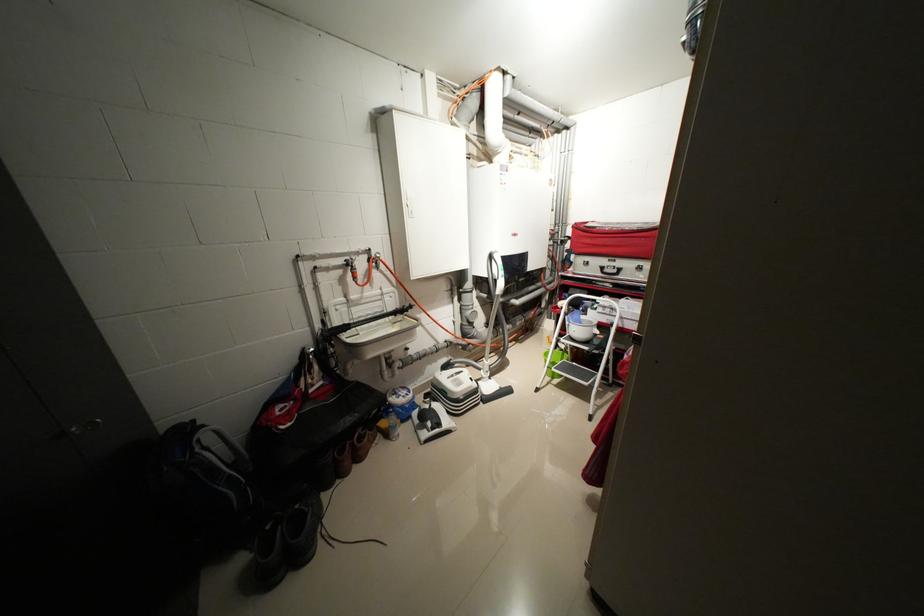
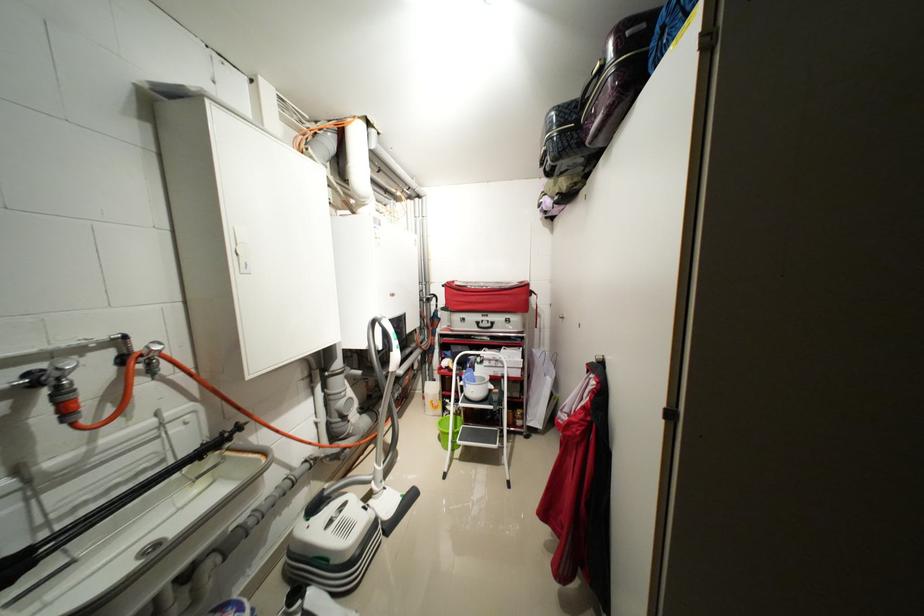
The point at (612, 308) is marked in the first image. Where is the corresponding point in the second image?

(496, 361)